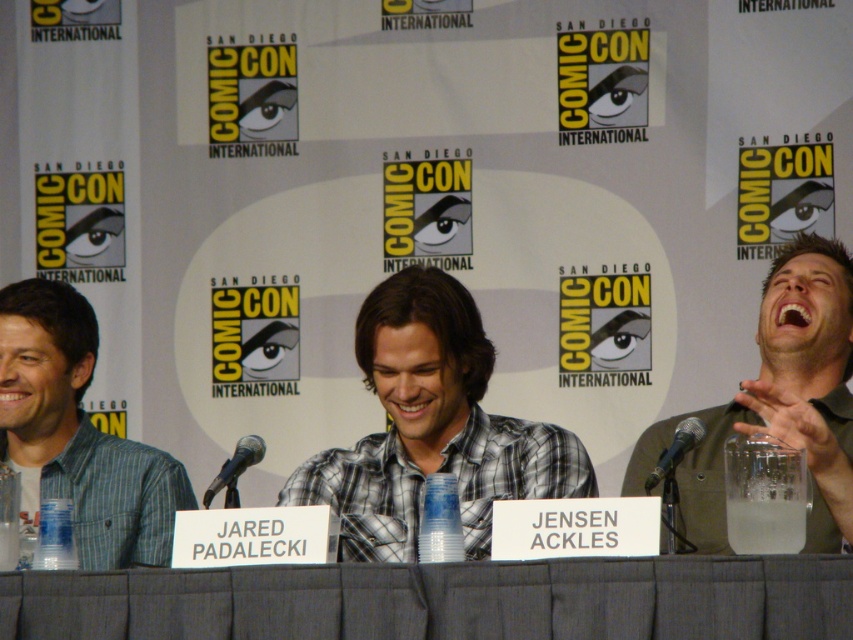
Question: Which of the following is the farthest from the observer?

Choices:
 (A) light blue plaid shirt at center
 (B) plaid cotton shirt at center
 (C) black metallic microphone at right

Answer: (A)

Question: Is green matte shirt at right further to camera compared to black metallic microphone at center?

Choices:
 (A) no
 (B) yes

Answer: (B)

Question: Which of the following is the farthest from the observer?

Choices:
 (A) (76, 545)
 (B) (242, 444)
 (C) (389, 300)

Answer: (C)

Question: Among these objects, which one is nearest to the camera?

Choices:
 (A) plaid cotton shirt at center
 (B) green matte shirt at right
 (C) black metallic microphone at center
 (D) black metallic microphone at right

Answer: (C)

Question: Can you confirm if gray fabric table at center is thinner than black metallic microphone at right?

Choices:
 (A) yes
 (B) no

Answer: (B)

Question: From the image, what is the correct spatial relationship of gray fabric table at center in relation to light blue plaid shirt at center?

Choices:
 (A) right
 (B) left

Answer: (A)